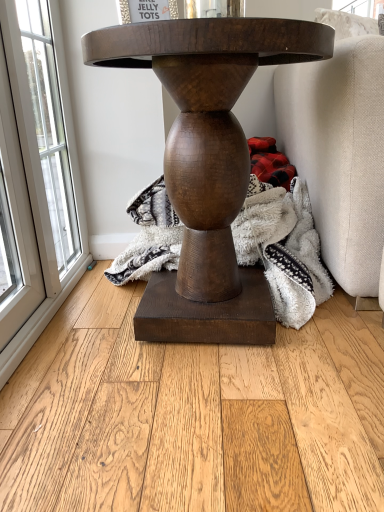
The width and height of the screenshot is (384, 512). I want to click on unoccupied area in front of matte brown wooden table at center, so click(x=204, y=428).